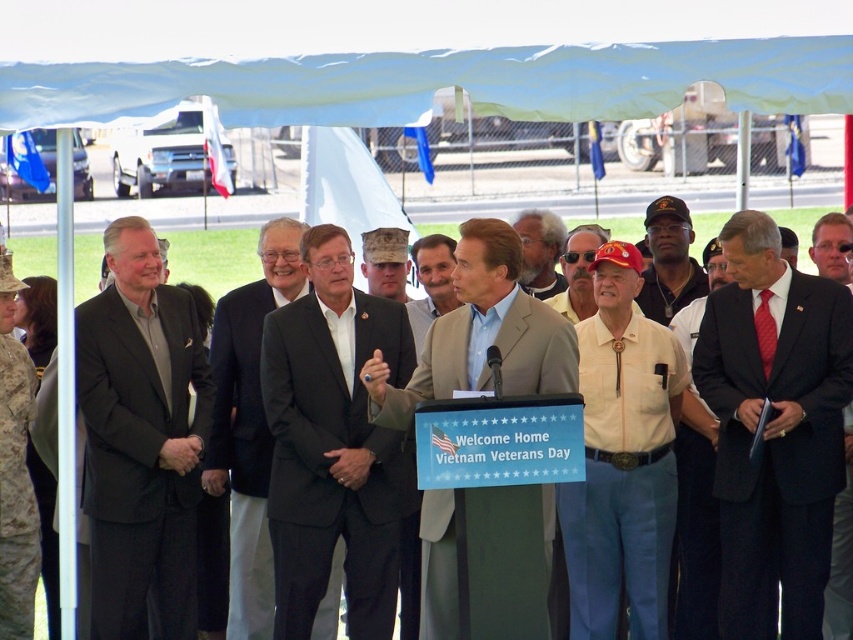
Where is `dark gray suit at left`? dark gray suit at left is located at coordinates (140, 440).

Based on the photo, is dark gray suit at left positioned at the back of beige fabric suit at center?

That is False.

At what (x,y) coordinates should I click in order to perform the action: click on dark gray suit at left. Please return your answer as a coordinate pair (x, y). Looking at the image, I should click on (140, 440).

Who is higher up, matte black cap at center or gray hair at center?

gray hair at center

The width and height of the screenshot is (853, 640). What do you see at coordinates (669, 260) in the screenshot? I see `matte black cap at center` at bounding box center [669, 260].

You are a GUI agent. You are given a task and a screenshot of the screen. Output one action in this format:
    pyautogui.click(x=<x>, y=<y>)
    Task: Click on the matte black cap at center
    The width and height of the screenshot is (853, 640).
    Given the screenshot: What is the action you would take?
    pyautogui.click(x=669, y=260)

Does beige fabric suit at center have a greater width compared to camouflage fabric hat at center?

Correct, the width of beige fabric suit at center exceeds that of camouflage fabric hat at center.

How distant is beige fabric suit at center from camouflage fabric hat at center?

They are 6.81 meters apart.

The width and height of the screenshot is (853, 640). Describe the element at coordinates (480, 333) in the screenshot. I see `beige fabric suit at center` at that location.

You are a GUI agent. You are given a task and a screenshot of the screen. Output one action in this format:
    pyautogui.click(x=<x>, y=<y>)
    Task: Click on the beige fabric suit at center
    
    Given the screenshot: What is the action you would take?
    pyautogui.click(x=480, y=333)